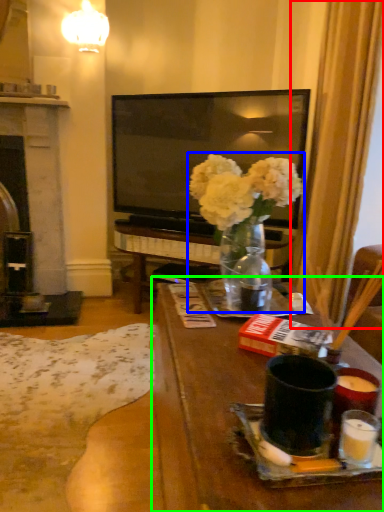
Question: Which object is positioned farthest from curtain (highlighted by a red box)? Select from floral arrangement (highlighted by a blue box) and table (highlighted by a green box).

Choices:
 (A) floral arrangement
 (B) table

Answer: (B)